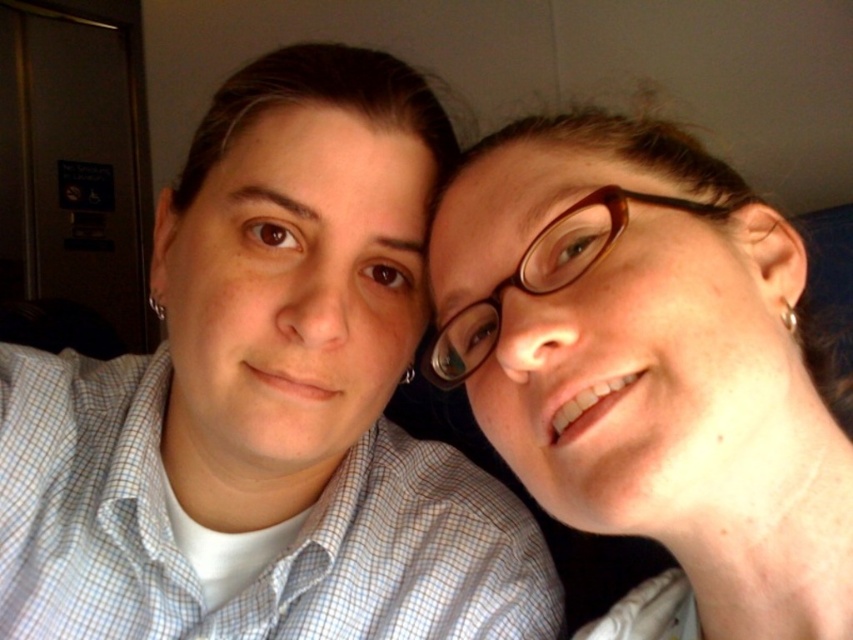
Question: Does brown glossy glasses at upper right come behind brown tortoiseshell glasses at center?

Choices:
 (A) no
 (B) yes

Answer: (A)

Question: Is brown glossy glasses at upper right closer to camera compared to brown tortoiseshell glasses at center?

Choices:
 (A) no
 (B) yes

Answer: (B)

Question: Which point appears closest to the camera in this image?

Choices:
 (A) (718, 180)
 (B) (590, 204)

Answer: (B)

Question: Can you confirm if brown glossy glasses at upper right is bigger than brown tortoiseshell glasses at center?

Choices:
 (A) yes
 (B) no

Answer: (A)

Question: Which of the following is the farthest from the observer?

Choices:
 (A) brown tortoiseshell glasses at center
 (B) brown glossy glasses at upper right

Answer: (A)